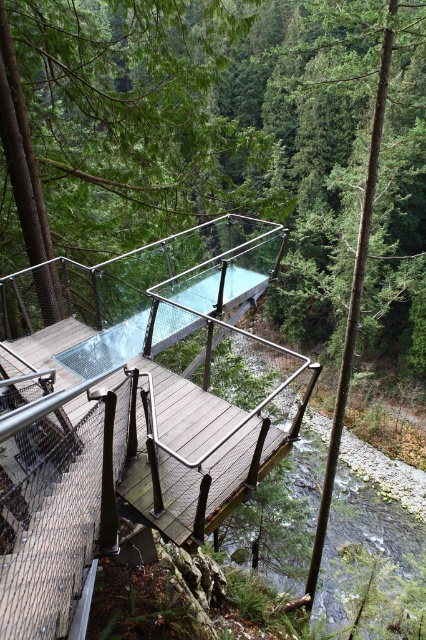
The height and width of the screenshot is (640, 426). I want to click on green matte glass at upper center, so click(x=129, y=118).

Locate an element on the screen. green matte glass at upper center is located at coordinates (129, 118).

Who is more forward, (x=9, y=552) or (x=129, y=234)?

Positioned in front is point (x=9, y=552).

Between wooden bridge at center and green matte glass at upper center, which one has more height?

With more height is green matte glass at upper center.

Where is `wooden bridge at center`? wooden bridge at center is located at coordinates (134, 413).

Based on the photo, is wooden bridge at center in front of transparent glass pool at center?

Yes, wooden bridge at center is in front of transparent glass pool at center.

Can you confirm if wooden bridge at center is shorter than transparent glass pool at center?

No, wooden bridge at center is not shorter than transparent glass pool at center.

Is point (69, 339) less distant than point (255, 275)?

Yes, it is in front of point (255, 275).

You are a GUI agent. You are given a task and a screenshot of the screen. Output one action in this format:
    pyautogui.click(x=<x>, y=<y>)
    Task: Click on the wooden bridge at center
    The height and width of the screenshot is (640, 426).
    Given the screenshot: What is the action you would take?
    (x=134, y=413)